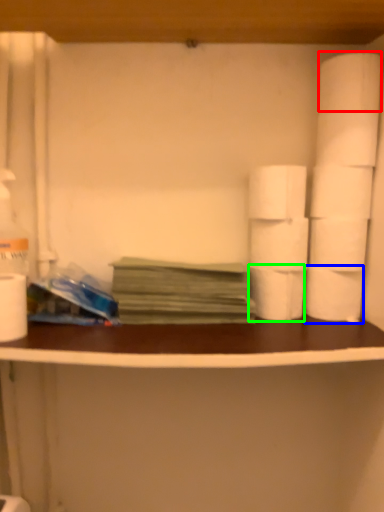
Question: Considering the real-world distances, which object is closest to toilet paper (highlighted by a red box)? toilet paper (highlighted by a blue box) or toilet paper (highlighted by a green box).

Choices:
 (A) toilet paper
 (B) toilet paper

Answer: (A)